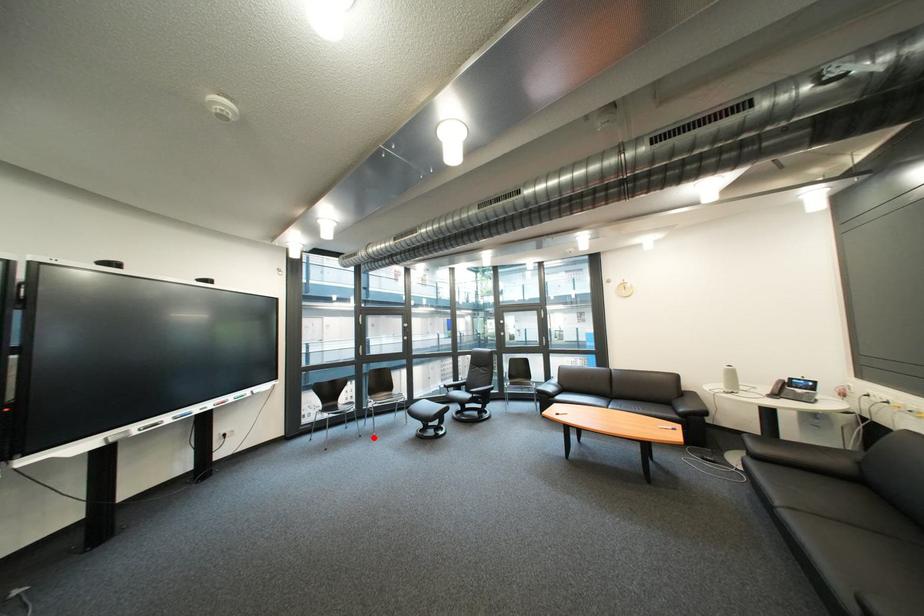
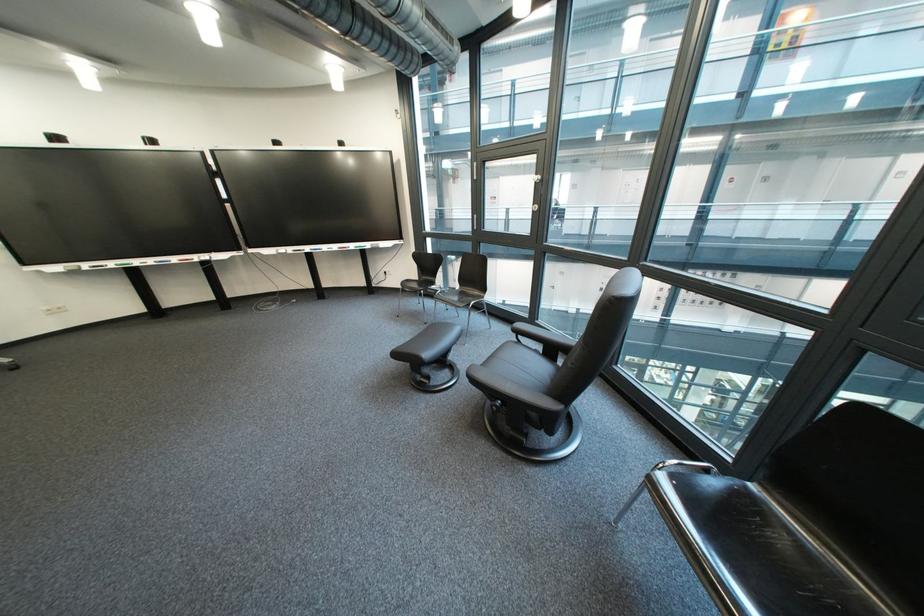
Question: I am providing you with two images of the same scene from different viewpoints. Given a red point in image1, look at the same physical point in image2. Is it:

Choices:
 (A) Closer to the viewpoint
 (B) Farther from the viewpoint

Answer: (B)